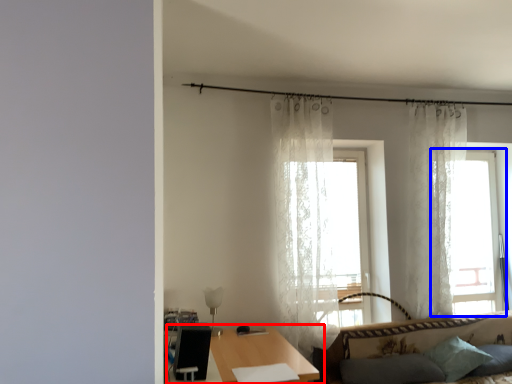
Question: Which of the following is the closest to the observer, table (highlighted by a red box) or window (highlighted by a blue box)?

Choices:
 (A) table
 (B) window

Answer: (A)